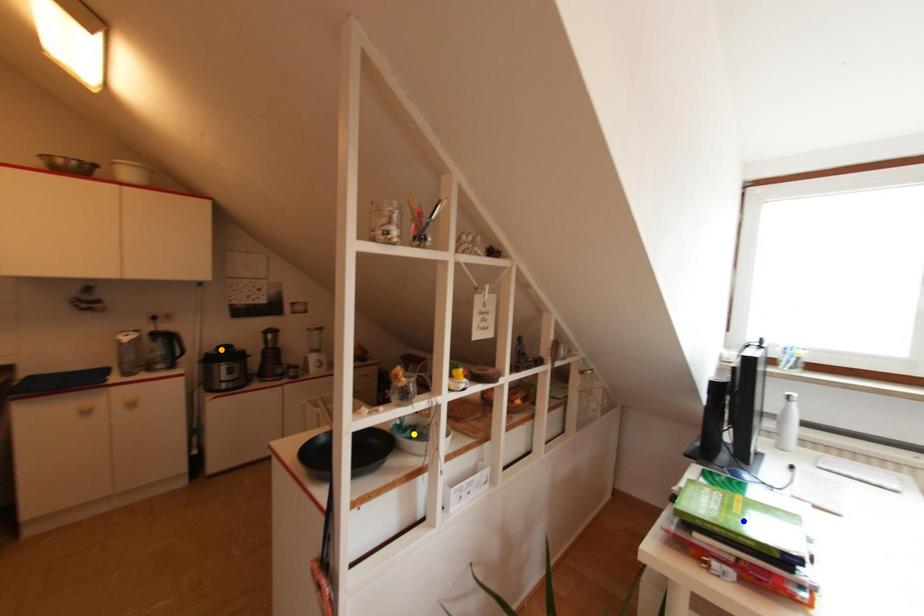
Order these from nearest to farthest:
blue point | orange point | yellow point

blue point < yellow point < orange point